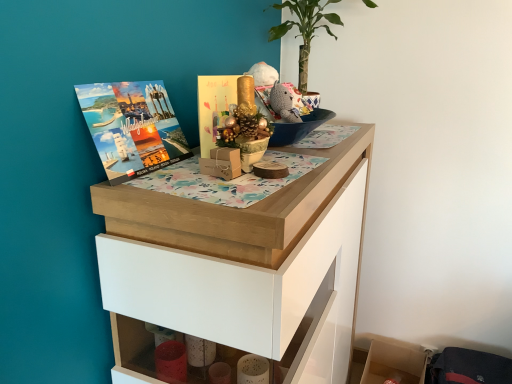
Question: Should I look upward or downward to see wooden shelf at lower right?

Choices:
 (A) down
 (B) up

Answer: (A)

Question: Is green leafy plant at upper center in front of wooden chest of drawers at upper center?

Choices:
 (A) no
 (B) yes

Answer: (A)

Question: Would you consider green leafy plant at upper center to be distant from wooden chest of drawers at upper center?

Choices:
 (A) no
 (B) yes

Answer: (A)

Question: Is green leafy plant at upper center positioned with its back to wooden chest of drawers at upper center?

Choices:
 (A) no
 (B) yes

Answer: (A)

Question: Is green leafy plant at upper center to the right of wooden chest of drawers at upper center from the viewer's perspective?

Choices:
 (A) no
 (B) yes

Answer: (B)

Question: From a real-world perspective, is green leafy plant at upper center on top of wooden chest of drawers at upper center?

Choices:
 (A) no
 (B) yes

Answer: (B)

Question: Is green leafy plant at upper center with wooden chest of drawers at upper center?

Choices:
 (A) yes
 (B) no

Answer: (B)

Question: Is green leafy plant at upper center taller than gold paper card at center, the 1th book cover viewed from the right?

Choices:
 (A) no
 (B) yes

Answer: (B)

Question: Considering the relative sizes of green leafy plant at upper center and gold paper card at center, which is counted as the second book cover, starting from the left, in the image provided, is green leafy plant at upper center thinner than gold paper card at center, which is counted as the second book cover, starting from the left,?

Choices:
 (A) yes
 (B) no

Answer: (B)

Question: Is green leafy plant at upper center looking in the opposite direction of gold paper card at center, which is counted as the second book cover, starting from the left?

Choices:
 (A) yes
 (B) no

Answer: (B)

Question: Does green leafy plant at upper center appear on the left side of gold paper card at center, the 1th book cover viewed from the right?

Choices:
 (A) yes
 (B) no

Answer: (B)

Question: From the image's perspective, is green leafy plant at upper center located above gold paper card at center, the 1th book cover viewed from the right?

Choices:
 (A) no
 (B) yes

Answer: (B)

Question: Are green leafy plant at upper center and gold paper card at center, which is counted as the second book cover, starting from the left, located far from each other?

Choices:
 (A) yes
 (B) no

Answer: (B)

Question: Is the position of gold paper card at center, which is counted as the second book cover, starting from the left, more distant than that of wooden chest of drawers at upper center?

Choices:
 (A) yes
 (B) no

Answer: (A)